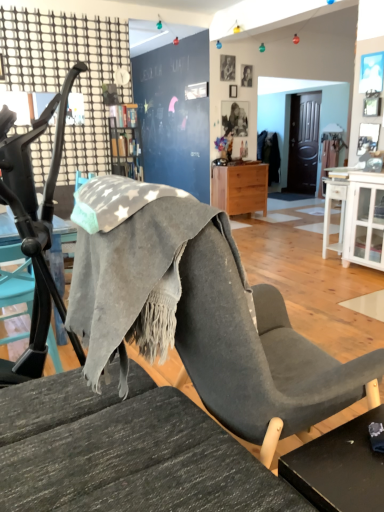
Measure the distance between point (49, 297) and camera.

Point (49, 297) is 1.77 meters from camera.

The height and width of the screenshot is (512, 384). Describe the element at coordinates (364, 220) in the screenshot. I see `white glossy cabinet at right` at that location.

Locate an element on the screen. Image resolution: width=384 pixels, height=512 pixels. smooth gray portrait at upper center, placed as the 2th person when sorted from back to front is located at coordinates (227, 67).

From the picture: Is smooth gray portrait at upper center, placed as the 2th person when sorted from back to front, oriented towards smooth skin portrait at upper center, which is counted as the first person, starting from the right?

No, smooth gray portrait at upper center, placed as the 2th person when sorted from back to front, does not turn towards smooth skin portrait at upper center, which is counted as the first person, starting from the right.

Which object is further away from the camera, smooth gray portrait at upper center, placed as the 2th person when sorted from back to front, or smooth skin portrait at upper center, the 1th person viewed from the back?

smooth skin portrait at upper center, the 1th person viewed from the back, is further from the camera.

You are a GUI agent. You are given a task and a screenshot of the screen. Output one action in this format:
    pyautogui.click(x=<x>, y=<y>)
    Task: Click on the person located underneath the smooth gray portrait at upper center, which ranks as the 1th person in front-to-back order (from a real-world perspective)
    
    Given the screenshot: What is the action you would take?
    pyautogui.click(x=246, y=75)

From the image's perspective, is smooth gray portrait at upper center, which is counted as the first person, starting from the left, located beneath white glossy cabinet at right?

Incorrect, from the image's perspective, smooth gray portrait at upper center, which is counted as the first person, starting from the left, is higher than white glossy cabinet at right.

Which object is wider, smooth gray portrait at upper center, which ranks as the 1th person in front-to-back order, or white glossy cabinet at right?

white glossy cabinet at right.

From a real-world perspective, is smooth gray portrait at upper center, which ranks as the 1th person in front-to-back order, above or below white glossy cabinet at right?

From a real-world perspective, smooth gray portrait at upper center, which ranks as the 1th person in front-to-back order, is physically above white glossy cabinet at right.

Which is more to the right, smooth gray portrait at upper center, placed as the 2th person when sorted from back to front, or white glossy cabinet at right?

Positioned to the right is white glossy cabinet at right.

Considering the sizes of black matte table at lower right and smooth gray portrait at upper center, placed as the 2th person when sorted from back to front, in the image, is black matte table at lower right bigger or smaller than smooth gray portrait at upper center, placed as the 2th person when sorted from back to front,?

black matte table at lower right is bigger than smooth gray portrait at upper center, placed as the 2th person when sorted from back to front.

Find the location of a particular element. The height and width of the screenshot is (512, 384). person that is the 2nd object located above the black matte table at lower right (from the image's perspective) is located at coordinates (227, 67).

How many degrees apart are the facing directions of black matte table at lower right and smooth gray portrait at upper center, marked as the 2th person in a right-to-left arrangement?

There is a 178-degree angle between the facing directions of black matte table at lower right and smooth gray portrait at upper center, marked as the 2th person in a right-to-left arrangement.

Who is shorter, black matte table at lower right or smooth gray portrait at upper center, which is counted as the first person, starting from the left?

smooth gray portrait at upper center, which is counted as the first person, starting from the left.

Considering the positions of objects wooden bookshelf at upper center and gray fabric chair at left in the image provided, who is more to the right, wooden bookshelf at upper center or gray fabric chair at left?

gray fabric chair at left.

Is gray fabric chair at left inside wooden bookshelf at upper center?

No, wooden bookshelf at upper center does not contain gray fabric chair at left.

From the picture: From the image's perspective, is wooden bookshelf at upper center located beneath gray fabric chair at left?

No, from the image's perspective, wooden bookshelf at upper center is not beneath gray fabric chair at left.

Which object is thinner, wooden bookshelf at upper center or gray fabric chair at left?

wooden bookshelf at upper center is thinner.

From a real-world perspective, is gray fabric chair at left above or below smooth skin portrait at upper center, which is counted as the first person, starting from the right?

gray fabric chair at left is situated lower than smooth skin portrait at upper center, which is counted as the first person, starting from the right, in the real world.

Choose the correct answer: Is gray fabric chair at left inside smooth skin portrait at upper center, which is counted as the first person, starting from the right, or outside it?

gray fabric chair at left exists outside the volume of smooth skin portrait at upper center, which is counted as the first person, starting from the right.

In the image, is gray fabric chair at left positioned in front of or behind smooth skin portrait at upper center, the 1th person viewed from the back?

gray fabric chair at left is positioned closer to the viewer than smooth skin portrait at upper center, the 1th person viewed from the back.

Consider the image. Looking at their sizes, would you say gray fabric chair at left is wider or thinner than smooth skin portrait at upper center, which is counted as the first person, starting from the right?

In the image, gray fabric chair at left appears to be wider than smooth skin portrait at upper center, which is counted as the first person, starting from the right.

Considering the relative sizes of light wood/texture nightstand at center and black matte table at lower right in the image provided, is light wood/texture nightstand at center thinner than black matte table at lower right?

In fact, light wood/texture nightstand at center might be wider than black matte table at lower right.

Is light wood/texture nightstand at center to the left or to the right of black matte table at lower right in the image?

Based on their positions, light wood/texture nightstand at center is located to the right of black matte table at lower right.

Based on the photo, measure the distance from light wood/texture nightstand at center to black matte table at lower right.

light wood/texture nightstand at center is 4.94 meters away from black matte table at lower right.

Is white glossy cabinet at right wider or thinner than wooden bookshelf at upper center?

Clearly, white glossy cabinet at right has more width compared to wooden bookshelf at upper center.

Is white glossy cabinet at right oriented away from wooden bookshelf at upper center?

That's not correct — white glossy cabinet at right is not looking away from wooden bookshelf at upper center.

Is there a large distance between white glossy cabinet at right and wooden bookshelf at upper center?

Yes, white glossy cabinet at right is far from wooden bookshelf at upper center.

Is white glossy cabinet at right not inside wooden bookshelf at upper center?

Yes, white glossy cabinet at right is located beyond the bounds of wooden bookshelf at upper center.

In order to click on person behind the smooth gray portrait at upper center, placed as the 2th person when sorted from back to front in this screenshot , I will do `click(246, 75)`.

From the image's perspective, count 2nd persons upward from the white glossy cabinet at right and point to it. Please provide its 2D coordinates.

[(227, 67)]

Estimate the real-world distances between objects in this image. Which object is further from gray fabric chair at left, light wood/texture nightstand at center or black matte table at lower right?

light wood/texture nightstand at center is positioned further to the anchor gray fabric chair at left.

Which object lies nearer to the anchor point smooth skin portrait at upper center, placed as the second person when sorted from front to back, light wood/texture nightstand at center or gray fabric chair at left?

light wood/texture nightstand at center lies closer to smooth skin portrait at upper center, placed as the second person when sorted from front to back, than the other object.

From the image, which object appears to be farther from white glossy cabinet at right, light wood/texture nightstand at center or wooden bookshelf at upper center?

wooden bookshelf at upper center.

When comparing their distances from smooth skin portrait at upper center, which is counted as the first person, starting from the right, does smooth gray portrait at upper center, which ranks as the 1th person in front-to-back order, or gray fabric chair at left seem closer?

smooth gray portrait at upper center, which ranks as the 1th person in front-to-back order, is closer to smooth skin portrait at upper center, which is counted as the first person, starting from the right.

Which object lies further to the anchor point gray fabric chair at left, wooden bookshelf at upper center or smooth skin portrait at upper center, the second person viewed from the left?

smooth skin portrait at upper center, the second person viewed from the left, lies further to gray fabric chair at left than the other object.

Estimate the real-world distances between objects in this image. Which object is closer to light wood/texture nightstand at center, black matte table at lower right or smooth skin portrait at upper center, which is counted as the first person, starting from the right?

The object closer to light wood/texture nightstand at center is smooth skin portrait at upper center, which is counted as the first person, starting from the right.

Which object lies further to the anchor point light wood/texture nightstand at center, smooth skin portrait at upper center, the 1th person viewed from the back, or smooth gray portrait at upper center, placed as the 2th person when sorted from back to front?

Based on the image, smooth gray portrait at upper center, placed as the 2th person when sorted from back to front, appears to be further to light wood/texture nightstand at center.

From the picture: Looking at the image, which one is located further to white glossy cabinet at right, black matte table at lower right or smooth gray portrait at upper center, which is counted as the first person, starting from the left?

black matte table at lower right is further to white glossy cabinet at right.

The width and height of the screenshot is (384, 512). I want to click on person positioned between white glossy cabinet at right and smooth skin portrait at upper center, the second person viewed from the left, from near to far, so click(x=227, y=67).

Where is `cabinetry located between gray fabric chair at left and smooth skin portrait at upper center, placed as the second person when sorted from front to back, in the depth direction`? cabinetry located between gray fabric chair at left and smooth skin portrait at upper center, placed as the second person when sorted from front to back, in the depth direction is located at coordinates (364, 220).

Locate an element on the screen. cabinetry between gray fabric chair at left and wooden bookshelf at upper center along the z-axis is located at coordinates (364, 220).

The image size is (384, 512). What are the coordinates of `nightstand between white glossy cabinet at right and smooth skin portrait at upper center, which is counted as the first person, starting from the right, along the z-axis` in the screenshot? It's located at (240, 188).